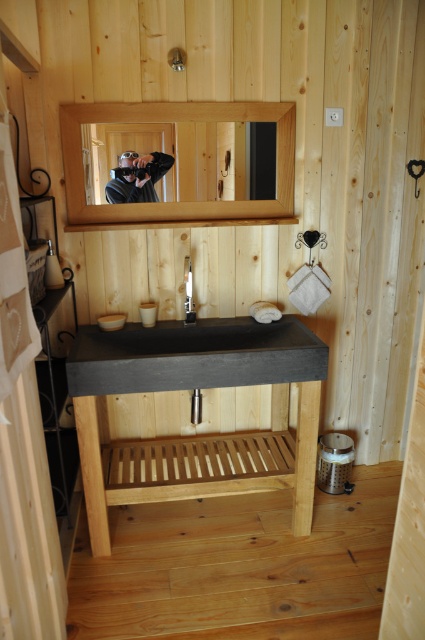
You are a drone flying at a certain height in the bathroom. You need to take a photo of two specific points marked in the scene. The first point is at coordinate point[153,381] and the second is at point[65,157]. Which point should you focus on first if you want to capture both points clearly in one shot?

Point[153,381] is closer to the camera than point[65,157], so you should focus on point[153,381] first to ensure both points are in focus.

In the rustic bathroom scene, there are two concrete sinks labeled as black concrete sink at center and dark concrete sink at center. According to their positions, which one is located to the right?

The black concrete sink at center is located to the right of the dark concrete sink at center.

You are standing in the bathroom and want to reach both the point at coordinates (85, 108) and the point at coordinates (124, 160). Which point is closer to you?

The point at coordinates (85, 108) is closer to you than the point at coordinates (124, 160).